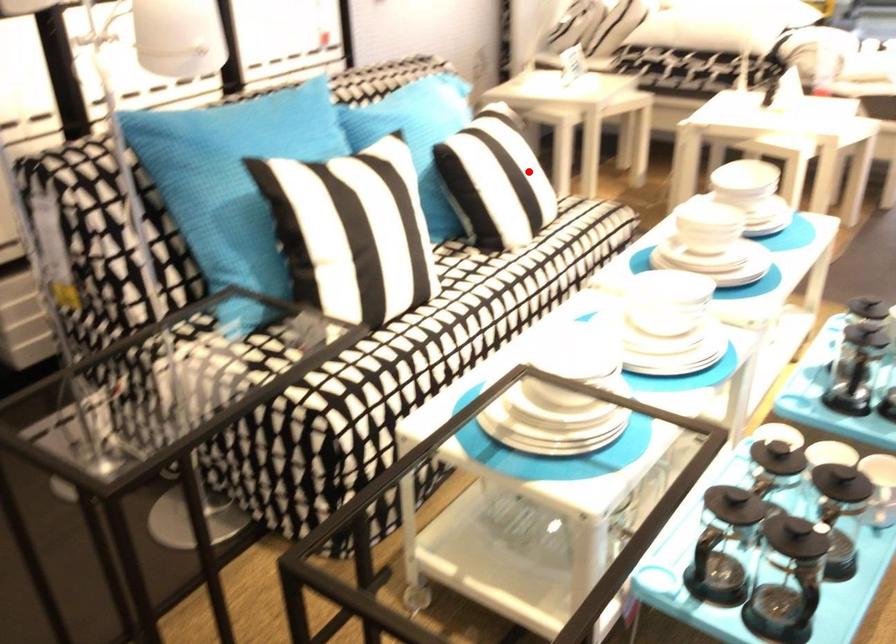
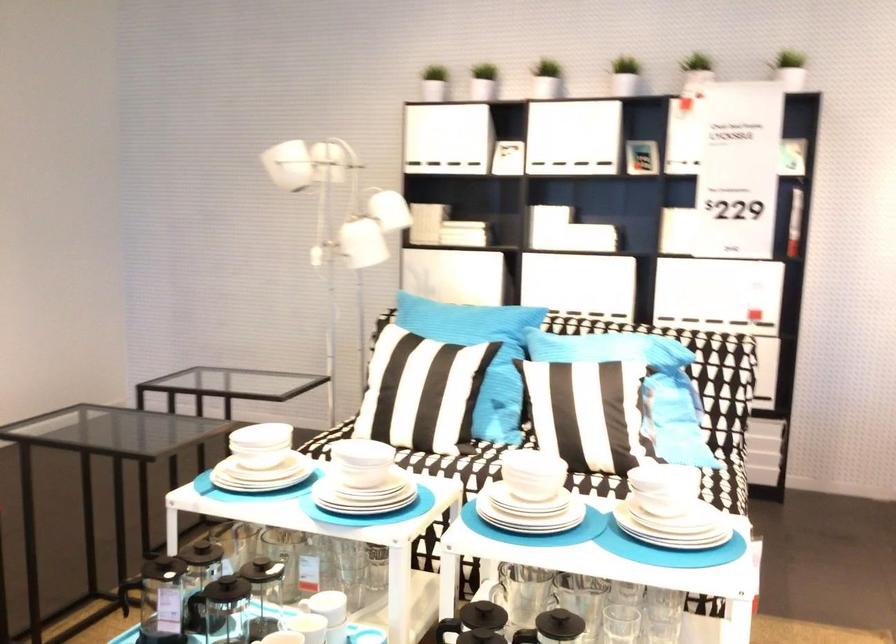
Find the pixel in the second image that matches the highlighted location in the first image.

(583, 404)